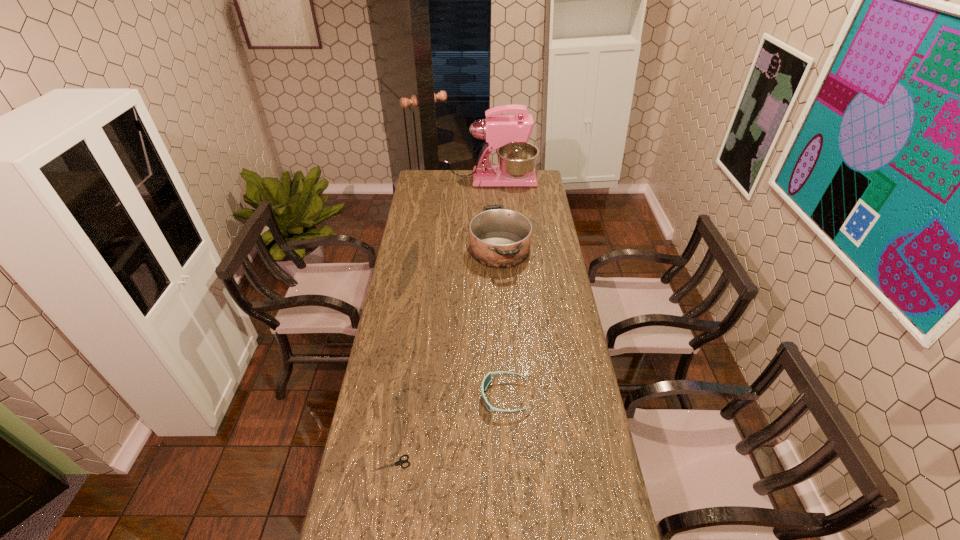
Locate an element on the screen. vacant space situated on the front-facing side of the goggles is located at coordinates (370, 396).

This screenshot has height=540, width=960. Find the location of `free space located on the front-facing side of the goggles`. free space located on the front-facing side of the goggles is located at coordinates (444, 396).

The image size is (960, 540). In order to click on free space located on the front-facing side of the goggles in this screenshot , I will do `click(385, 396)`.

I want to click on vacant point located 0.160m on the front of the leftmost object, so click(381, 531).

Find the location of a particular element. object present at the far edge is located at coordinates (507, 134).

Locate an element on the screen. The height and width of the screenshot is (540, 960). object positioned at the left edge is located at coordinates (400, 462).

The width and height of the screenshot is (960, 540). What are the coordinates of `mixer present at the right edge` in the screenshot? It's located at (507, 134).

In order to click on saucepan present at the right edge in this screenshot , I will do `click(500, 238)`.

Locate an element on the screen. Image resolution: width=960 pixels, height=540 pixels. object present at the far right corner is located at coordinates (507, 134).

Identify the location of free region at the far edge. Image resolution: width=960 pixels, height=540 pixels. (446, 170).